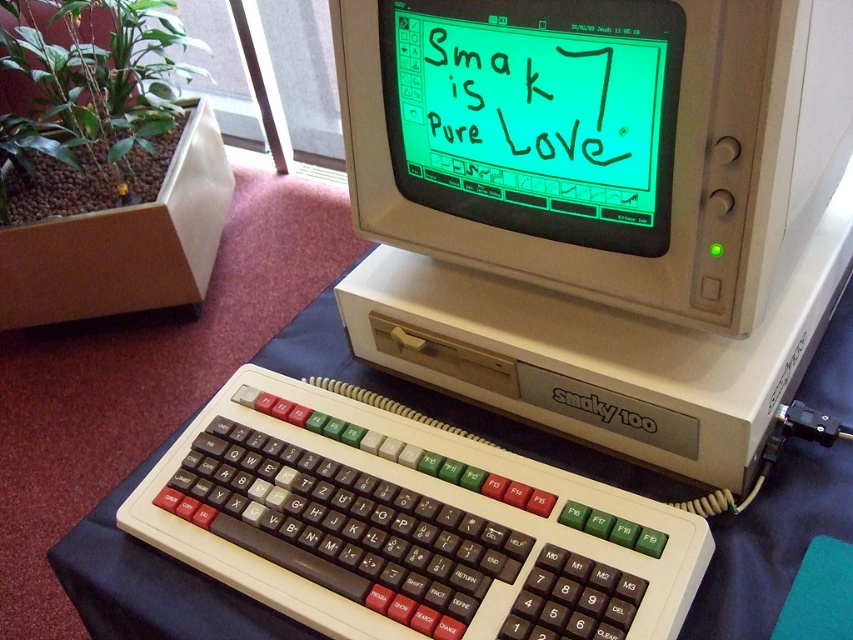
Between green matte monitor at center and black plastic smaky 100 at center, which one appears on the right side from the viewer's perspective?

Positioned to the right is black plastic smaky 100 at center.

Who is lower down, green matte monitor at center or black plastic smaky 100 at center?

black plastic smaky 100 at center

From the picture: Who is more distant from viewer, (x=480, y=17) or (x=561, y=404)?

The point (x=561, y=404) is more distant.

Identify the location of green matte monitor at center. This screenshot has height=640, width=853. (537, 113).

Identify the location of brown plastic keyboard at center. This screenshot has width=853, height=640. (408, 525).

At what (x,y) coordinates should I click in order to perform the action: click on brown plastic keyboard at center. Please return your answer as a coordinate pair (x, y). This screenshot has height=640, width=853. Looking at the image, I should click on (408, 525).

Is beige plastic smaky 100 at center shorter than green leafy plant at left?

Correct, beige plastic smaky 100 at center is not as tall as green leafy plant at left.

Is the position of beige plastic smaky 100 at center less distant than that of green leafy plant at left?

Yes, it is.

Is point (461, 268) behind point (97, 164)?

No.

Find the location of a particular element. This screenshot has height=640, width=853. beige plastic smaky 100 at center is located at coordinates click(601, 205).